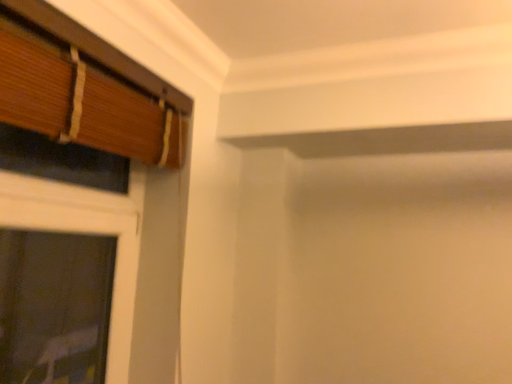
Question: Is wooden blinds at left, which is the 2th window from right to left, facing away from wooden blinds at left, which is the 2th window in left-to-right order?

Choices:
 (A) yes
 (B) no

Answer: (A)

Question: Is wooden blinds at left, which is the 2th window from right to left, at the left side of wooden blinds at left, which is the 2th window in left-to-right order?

Choices:
 (A) yes
 (B) no

Answer: (A)

Question: Does wooden blinds at left, which is the 2th window from right to left, have a greater height compared to wooden blinds at left, which is the 2th window in left-to-right order?

Choices:
 (A) yes
 (B) no

Answer: (A)

Question: Does wooden blinds at left, which is the 2th window from right to left, come behind wooden blinds at left, the first window in the right-to-left sequence?

Choices:
 (A) yes
 (B) no

Answer: (A)

Question: Does wooden blinds at left, which is the 2th window from right to left, have a lesser height compared to wooden blinds at left, the first window in the right-to-left sequence?

Choices:
 (A) yes
 (B) no

Answer: (B)

Question: Would you say wooden blinds at left, which is the 2th window from right to left, is outside wooden blinds at left, which is the 2th window in left-to-right order?

Choices:
 (A) yes
 (B) no

Answer: (A)

Question: Does wooden blinds at left, which is the 2th window in left-to-right order, have a smaller size compared to wooden blinds at left, the 1th window positioned from the left?

Choices:
 (A) yes
 (B) no

Answer: (A)

Question: Is wooden blinds at left, which is the 2th window in left-to-right order, thinner than wooden blinds at left, the 1th window positioned from the left?

Choices:
 (A) yes
 (B) no

Answer: (A)

Question: From a real-world perspective, is wooden blinds at left, the first window in the right-to-left sequence, under wooden blinds at left, which is the 2th window from right to left?

Choices:
 (A) no
 (B) yes

Answer: (A)

Question: Is wooden blinds at left, the first window in the right-to-left sequence, closer to the viewer compared to wooden blinds at left, which is the 2th window from right to left?

Choices:
 (A) yes
 (B) no

Answer: (A)

Question: Is there a large distance between wooden blinds at left, the first window in the right-to-left sequence, and wooden blinds at left, which is the 2th window from right to left?

Choices:
 (A) yes
 (B) no

Answer: (B)

Question: From a real-world perspective, is wooden blinds at left, which is the 2th window in left-to-right order, physically above wooden blinds at left, which is the 2th window from right to left?

Choices:
 (A) no
 (B) yes

Answer: (B)

Question: Visually, is wooden blinds at left, the first window in the right-to-left sequence, positioned to the left or to the right of wooden blinds at left, which is the 2th window from right to left?

Choices:
 (A) right
 (B) left

Answer: (A)